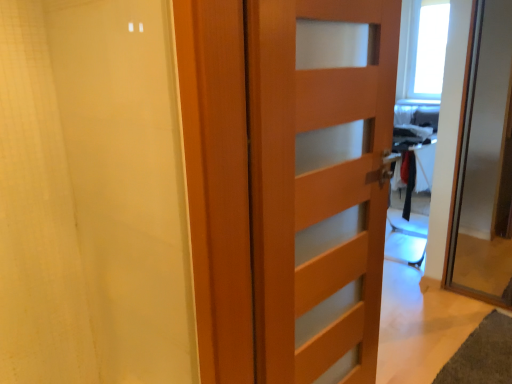
Question: From a real-world perspective, is wooden door at center, the 1th door positioned from the left, physically below white matte shower curtain at left?

Choices:
 (A) no
 (B) yes

Answer: (B)

Question: Is wooden door at center, which is the second door in right-to-left order, looking in the opposite direction of white matte shower curtain at left?

Choices:
 (A) no
 (B) yes

Answer: (A)

Question: Is wooden door at center, which is the second door in right-to-left order, with white matte shower curtain at left?

Choices:
 (A) yes
 (B) no

Answer: (B)

Question: Is wooden door at center, the 1th door positioned from the left, wider than white matte shower curtain at left?

Choices:
 (A) no
 (B) yes

Answer: (A)

Question: Is white matte shower curtain at left inside wooden door at center, the 1th door positioned from the left?

Choices:
 (A) yes
 (B) no

Answer: (B)

Question: Considering the positions of wooden door at right, arranged as the 2th door when viewed from the left, and white matte shower curtain at left in the image, is wooden door at right, arranged as the 2th door when viewed from the left, bigger or smaller than white matte shower curtain at left?

Choices:
 (A) big
 (B) small

Answer: (A)

Question: Visually, is wooden door at right, which appears as the first door when viewed from the right, positioned to the left or to the right of white matte shower curtain at left?

Choices:
 (A) right
 (B) left

Answer: (A)

Question: In the image, is wooden door at right, arranged as the 2th door when viewed from the left, positioned in front of or behind white matte shower curtain at left?

Choices:
 (A) front
 (B) behind

Answer: (B)

Question: Looking at their shapes, would you say wooden door at right, arranged as the 2th door when viewed from the left, is wider or thinner than white matte shower curtain at left?

Choices:
 (A) thin
 (B) wide

Answer: (B)

Question: In the image, is wooden door at center, the 1th door positioned from the left, positioned in front of or behind wooden door at right, which appears as the first door when viewed from the right?

Choices:
 (A) front
 (B) behind

Answer: (A)

Question: From a real-world perspective, is wooden door at center, the 1th door positioned from the left, physically located above or below wooden door at right, arranged as the 2th door when viewed from the left?

Choices:
 (A) below
 (B) above

Answer: (A)

Question: Is wooden door at center, which is the second door in right-to-left order, taller or shorter than wooden door at right, arranged as the 2th door when viewed from the left?

Choices:
 (A) tall
 (B) short

Answer: (A)

Question: Is wooden door at center, which is the second door in right-to-left order, inside or outside of wooden door at right, which appears as the first door when viewed from the right?

Choices:
 (A) inside
 (B) outside

Answer: (B)

Question: Is white matte shower curtain at left taller or shorter than wooden door at right, which appears as the first door when viewed from the right?

Choices:
 (A) short
 (B) tall

Answer: (A)

Question: Would you say white matte shower curtain at left is to the left or to the right of wooden door at right, which appears as the first door when viewed from the right, in the picture?

Choices:
 (A) left
 (B) right

Answer: (A)